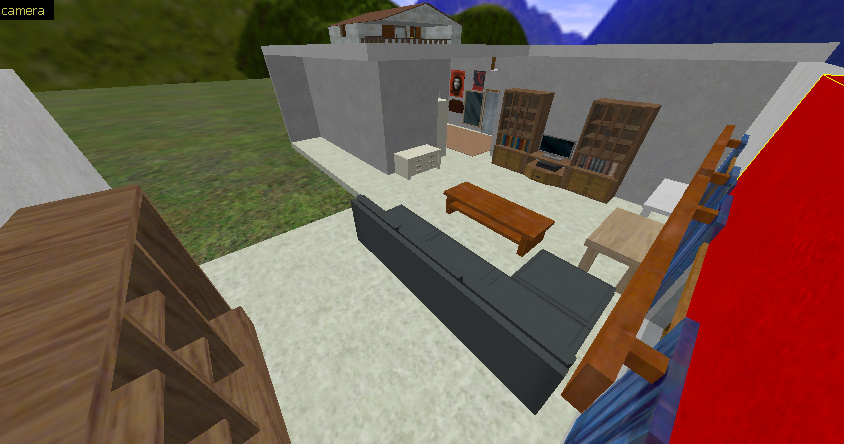
You are a GUI agent. You are given a task and a screenshot of the screen. Output one action in this format:
    pyautogui.click(x=<x>, y=<y>)
    Task: Click on the table
    The height and width of the screenshot is (444, 844).
    Given the screenshot: What is the action you would take?
    pyautogui.click(x=507, y=218)